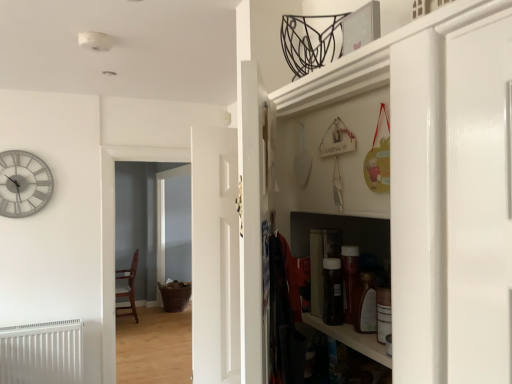
Question: In terms of size, does white glossy door at center, acting as the 2th door starting from the back, appear bigger or smaller than wooden chair at left?

Choices:
 (A) small
 (B) big

Answer: (A)

Question: Is white glossy door at center, acting as the 2th door starting from the back, in front of or behind wooden chair at left in the image?

Choices:
 (A) behind
 (B) front

Answer: (B)

Question: Considering the real-world distances, which object is closest to the white painted wood door at center, the 2th door viewed from the front?

Choices:
 (A) silver metallic clock at left
 (B) white matte radiator at lower left
 (C) brown woven basket at center
 (D) wooden chair at left
 (E) white glossy cabinet at right

Answer: (E)

Question: Considering the real-world distances, which object is closest to the white matte radiator at lower left?

Choices:
 (A) white glossy door at center, which appears as the first door when viewed from the front
 (B) wooden chair at left
 (C) white painted wood door at center, the second door when ordered from right to left
 (D) white glossy cabinet at right
 (E) brown woven basket at center

Answer: (C)